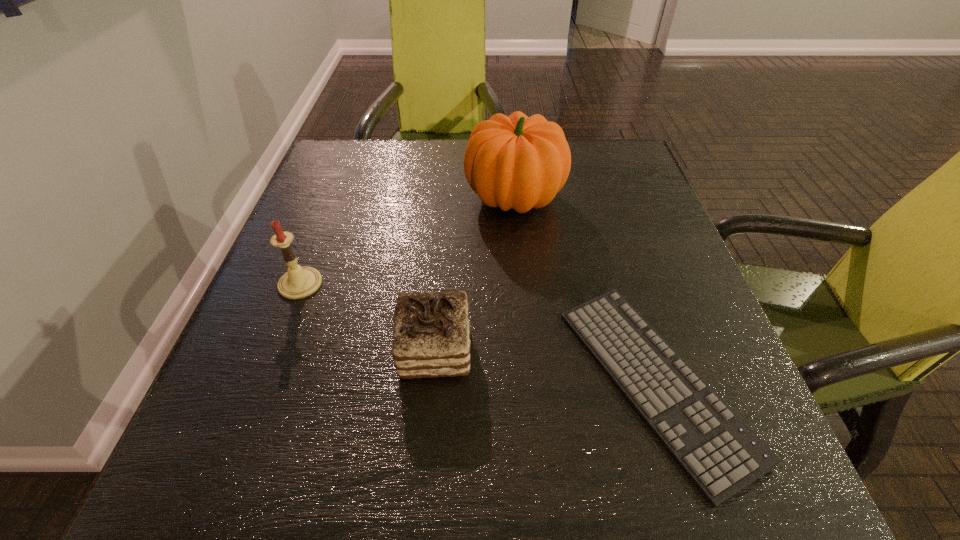
Locate an element on the screen. object that is at the far edge is located at coordinates (519, 162).

The height and width of the screenshot is (540, 960). I want to click on object present at the near edge, so click(722, 455).

I want to click on object present at the left edge, so click(x=298, y=282).

Identify the location of object that is positioned at the right edge. Image resolution: width=960 pixels, height=540 pixels. (722, 455).

Find the location of a particular element. object at the near right corner is located at coordinates [722, 455].

The height and width of the screenshot is (540, 960). What are the coordinates of `free space at the far edge of the desktop` in the screenshot? It's located at (428, 190).

Image resolution: width=960 pixels, height=540 pixels. In order to click on free spot at the near edge of the desktop in this screenshot , I will do `click(665, 508)`.

In the image, there is a desktop. Identify the location of free region at the left edge. The image size is (960, 540). (300, 400).

This screenshot has width=960, height=540. In the image, there is a desktop. Find the location of `vacant space at the right edge`. vacant space at the right edge is located at coordinates [695, 322].

Where is `vacant space at the far left corner of the desktop`? This screenshot has width=960, height=540. vacant space at the far left corner of the desktop is located at coordinates (355, 160).